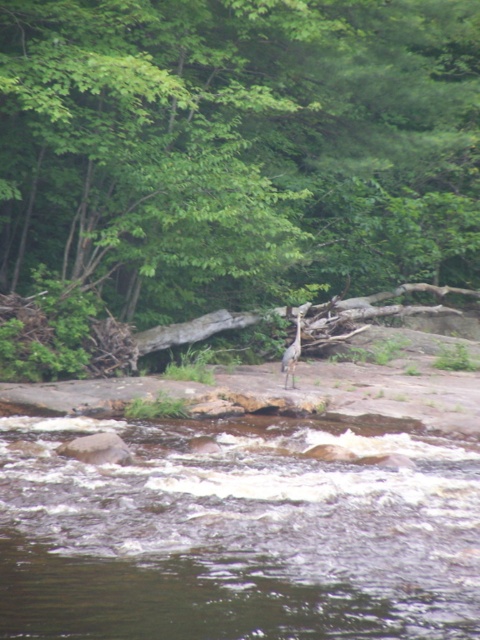
From the picture: You are a hiker navigating through the forest near the river. You spot two points marked on a map at coordinates point (156,461) and point (300,330). Which point is closer to your current position if you are facing the river from the forest trail?

Point (156,461) is closer to your current position because it is in front of point (300,330) when facing the river from the forest trail.

You are a photographer standing at the edge of the river in the forest. You want to take a photo that includes both the point at coordinates (10, 109) and the point at coordinates (346, 499). Which point will appear closer to the front of the photo?

Point at coordinates (10, 109) will appear closer to the front of the photo because it is further to the camera than point at coordinates (346, 499).

You are a hiker trying to navigate through the forest and need to locate the green leafy tree at center. Based on the coordinates provided, can you determine if the tree is positioned closer to the left or right side of the scene?

The green leafy tree at center is located at point 0.237 on the x and 0.487 on the y. Since the x coordinate is less than 0.5, the tree is closer to the left side of the scene.